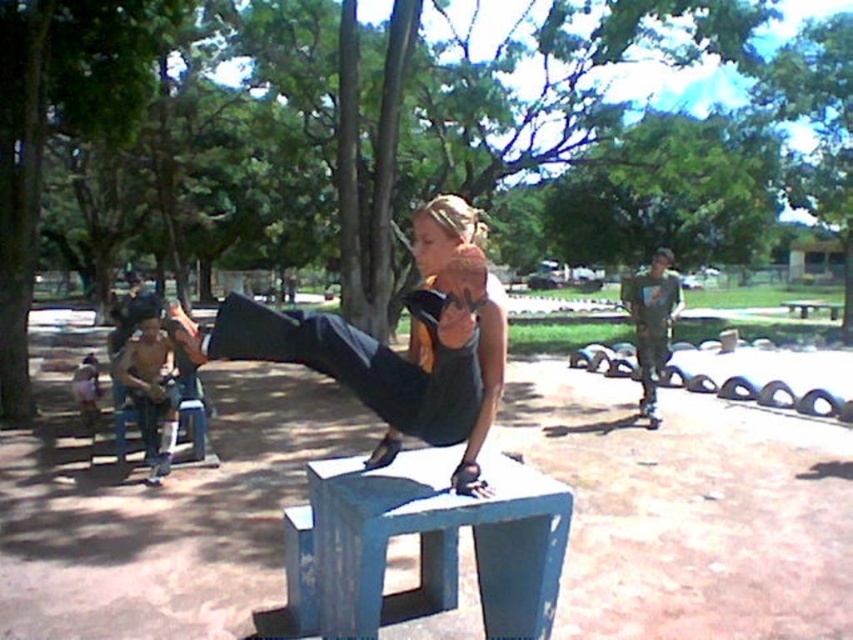
You are standing in the park and see the shiny metallic helmet at left and the black rubber shoe at center. Which object is closer to you?

The shiny metallic helmet at left is closer to you because it is further to the viewer than the black rubber shoe at center.

You are planning to set up a small picnic area in the park. You have two benches available, the blue painted concrete bench at center and the wooden park bench at center. Considering their positions, which bench would allow you to place a picnic blanket closer to the shaded area under the trees in the background?

The wooden park bench at center is closer to the shaded area under the trees in the background because it is positioned between the blue painted concrete bench at center and the trees, as they are 23.43 meters apart.